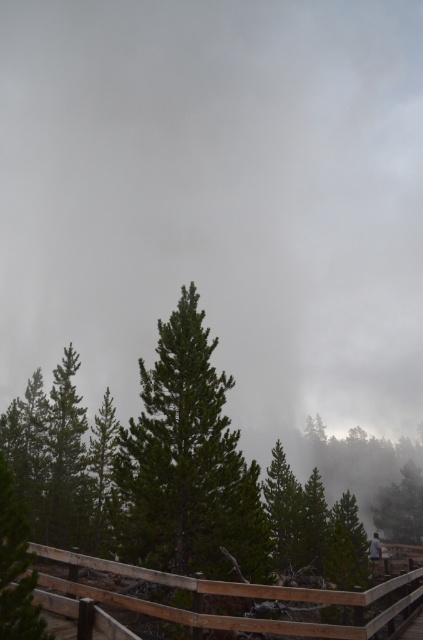
Question: Which is nearer to the light gray fabric jacket at center?

Choices:
 (A) green matte tree at center
 (B) green matte tree at lower left

Answer: (A)

Question: Is green matte tree at lower left positioned before light gray fabric jacket at center?

Choices:
 (A) no
 (B) yes

Answer: (B)

Question: Does green matte tree at center appear on the right side of green matte tree at lower left?

Choices:
 (A) no
 (B) yes

Answer: (A)

Question: Estimate the real-world distances between objects in this image. Which object is farther from the light gray fabric jacket at center?

Choices:
 (A) green matte tree at lower left
 (B) green matte tree at center

Answer: (A)

Question: Can you confirm if green matte tree at center is positioned below green matte tree at lower left?

Choices:
 (A) yes
 (B) no

Answer: (A)

Question: Which point is closer to the camera?

Choices:
 (A) (373, 557)
 (B) (186, 310)

Answer: (B)